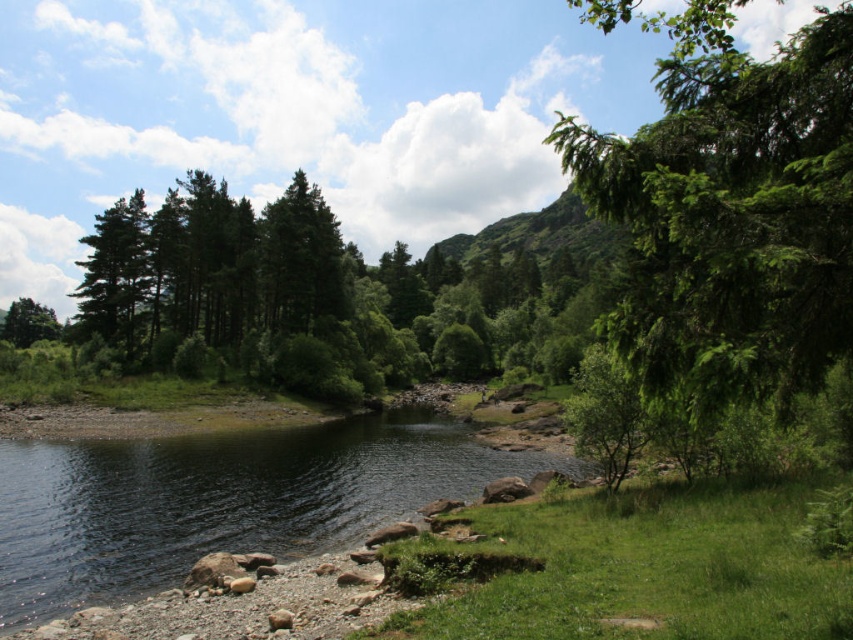
Question: Is green leafy tree at right thinner than green grassy river at lower left?

Choices:
 (A) yes
 (B) no

Answer: (B)

Question: Is green leafy tree at right behind green grassy river at lower left?

Choices:
 (A) no
 (B) yes

Answer: (A)

Question: Which of the following is the farthest from the observer?

Choices:
 (A) green matte tree at left
 (B) green grassy river at lower left
 (C) green leafy tree at right

Answer: (A)

Question: From the image, what is the correct spatial relationship of green grassy river at lower left in relation to green matte tree at left?

Choices:
 (A) below
 (B) above

Answer: (A)

Question: Which point is farther to the camera?

Choices:
 (A) (387, 513)
 (B) (3, 317)

Answer: (B)

Question: Among these objects, which one is farthest from the camera?

Choices:
 (A) green leafy tree at right
 (B) green grassy river at lower left
 (C) green matte tree at left

Answer: (C)